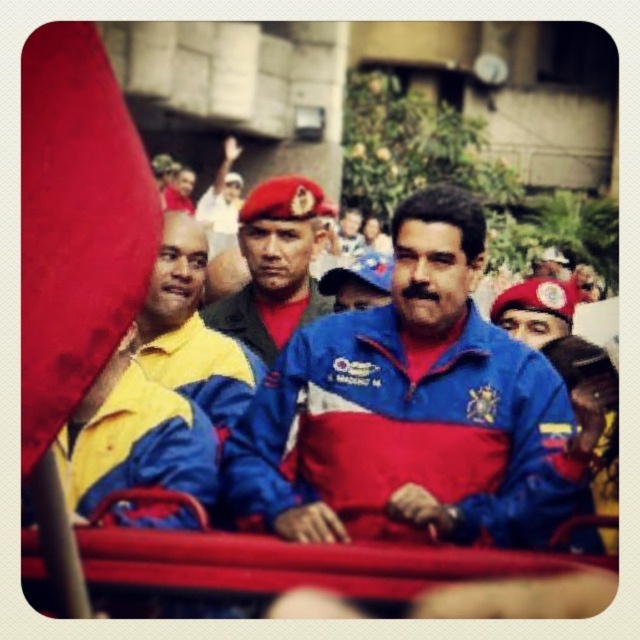
Who is taller, smooth red flag at left or yellow fabric shirt at left?

smooth red flag at left

Is smooth red flag at left thinner than yellow fabric shirt at left?

Yes.

Is point (116, 147) more distant than point (192, 344)?

No, it is not.

At what (x,y) coordinates should I click in order to perform the action: click on smooth red flag at left. Please return your answer as a coordinate pair (x, y). Looking at the image, I should click on (76, 225).

Is yellow fabric shirt at left behind matte red beret at center?

No, yellow fabric shirt at left is closer to the viewer.

Is point (176, 220) positioned behind point (227, 321)?

That is False.

Where is `yellow fabric shirt at left`? The height and width of the screenshot is (640, 640). yellow fabric shirt at left is located at coordinates (192, 330).

Between blue/red zip-up jacket at center and yellow fabric shirt at left, which one has more height?

blue/red zip-up jacket at center is taller.

Who is shorter, blue/red zip-up jacket at center or yellow fabric shirt at left?

Standing shorter between the two is yellow fabric shirt at left.

Between point (355, 452) and point (182, 260), which one is positioned behind?

Positioned behind is point (182, 260).

Locate an element on the screen. blue/red zip-up jacket at center is located at coordinates (410, 412).